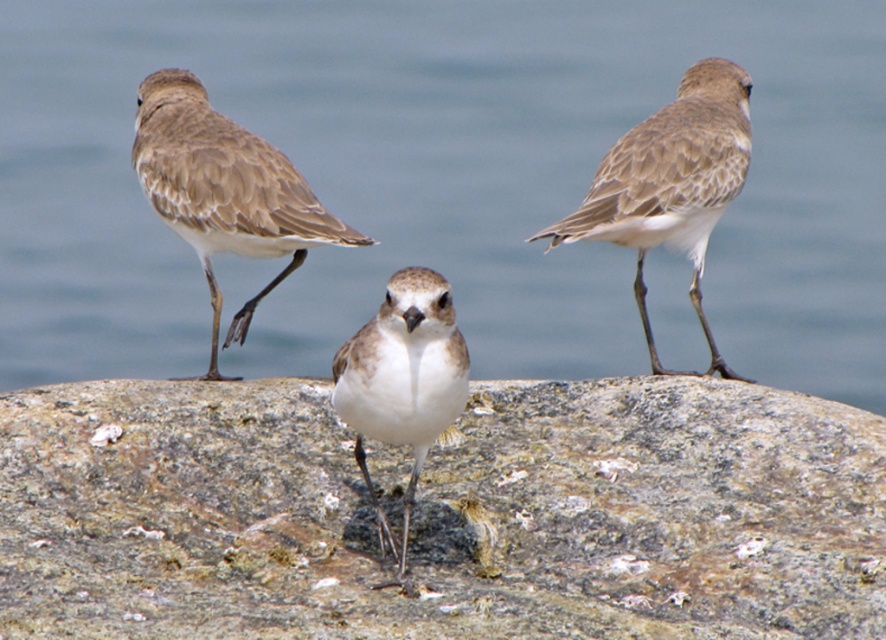
Question: Which is nearer to the rough textured rock at center?

Choices:
 (A) white matte bird at center
 (B) brown speckled feathers at upper right
 (C) brown speckled feathers at left
 (D) blue water at center

Answer: (A)

Question: Which point appears closest to the camera in this image?

Choices:
 (A) (247, 253)
 (B) (723, 172)
 (C) (282, 525)

Answer: (C)

Question: Is the position of blue water at center more distant than that of brown speckled feathers at upper right?

Choices:
 (A) no
 (B) yes

Answer: (B)

Question: Is blue water at center in front of brown speckled feathers at upper right?

Choices:
 (A) no
 (B) yes

Answer: (A)

Question: Which object is positioned farthest from the blue water at center?

Choices:
 (A) rough textured rock at center
 (B) brown speckled feathers at left
 (C) white matte bird at center

Answer: (C)

Question: Can you confirm if rough textured rock at center is positioned above brown speckled feathers at left?

Choices:
 (A) no
 (B) yes

Answer: (A)